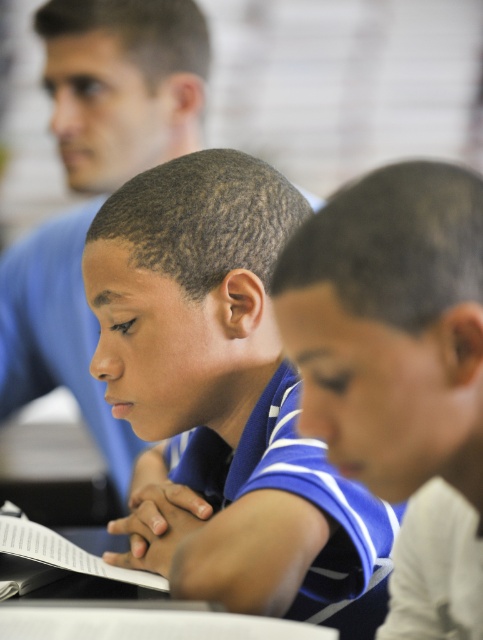
You are a student in the classroom and you want to hand in your homework to the teacher. The teacher is wearing the blue shirt at upper left. Where should you go relative to the blue jersey at center?

The teacher wearing the blue shirt at upper left is located above the blue jersey at center, so you should go towards the upper left direction from the blue jersey at center to reach the teacher.

You are a tailor who needs to determine which garment requires more fabric between the blue striped polo shirt at center and the blue shirt at upper left. Based on the image, which one would you prioritize for fabric allocation?

The blue striped polo shirt at center is larger in size than the blue shirt at upper left, so it would require more fabric and should be prioritized for fabric allocation.

You are standing in the classroom and see two points marked on the desk. The first point is at position point [287,312] and the second is at point [81,330]. Which point is closer to you?

Point [287,312] is closer to the viewer than point [81,330].